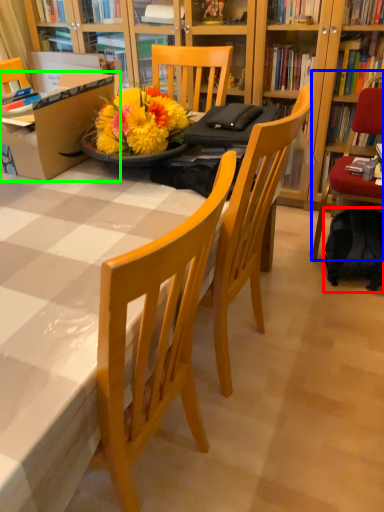
Question: Which is farther away from backpack (highlighted by a red box)? chair (highlighted by a blue box) or box (highlighted by a green box)?

Choices:
 (A) chair
 (B) box

Answer: (B)